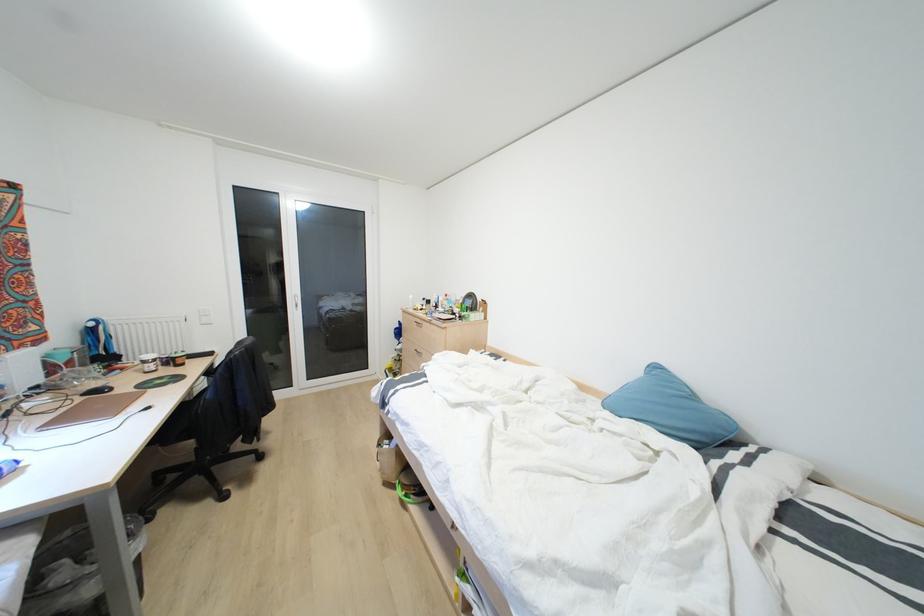
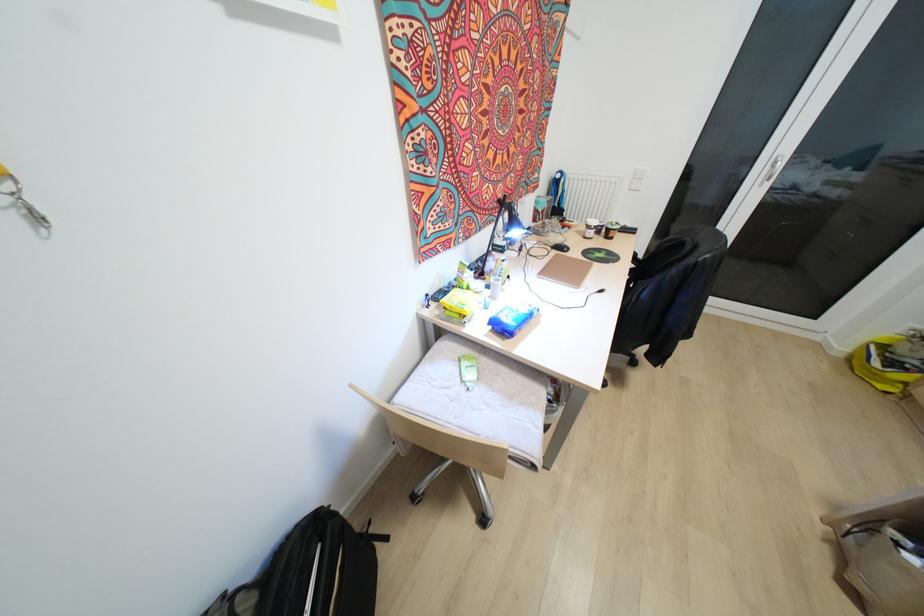
In the second image, find the point that corresponds to point 68,362 in the first image.

(541, 209)